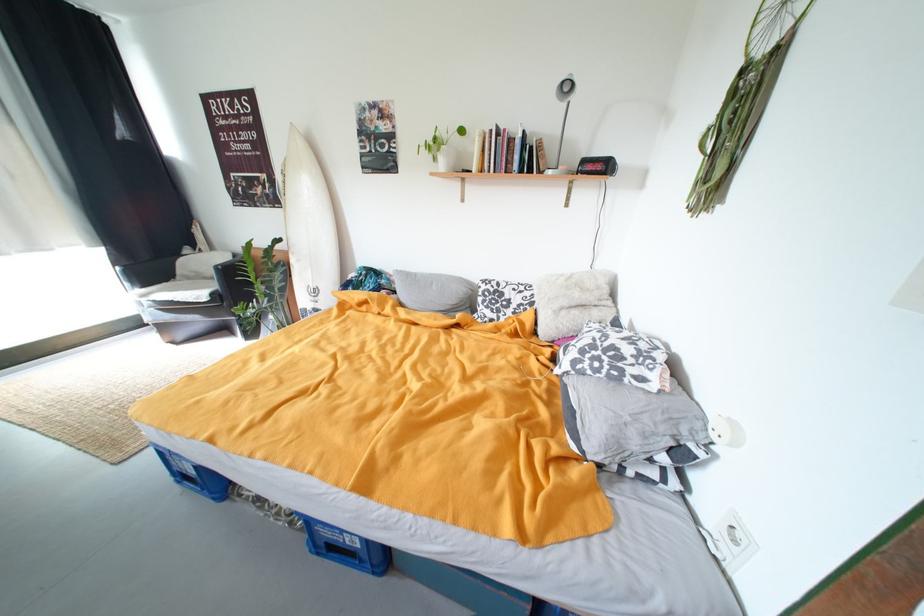
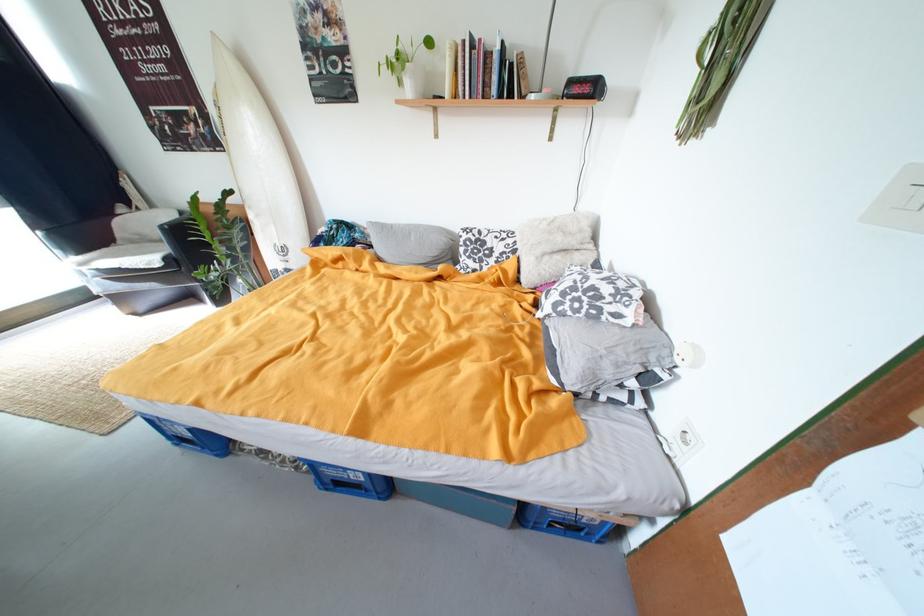
Find the pixel in the second image that matches pixel 222 280 in the first image.

(169, 243)